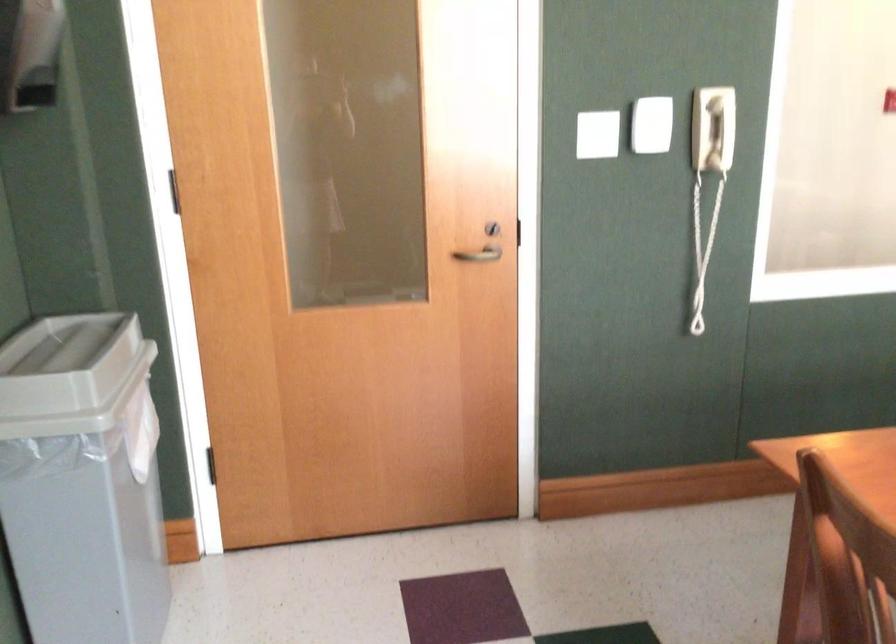
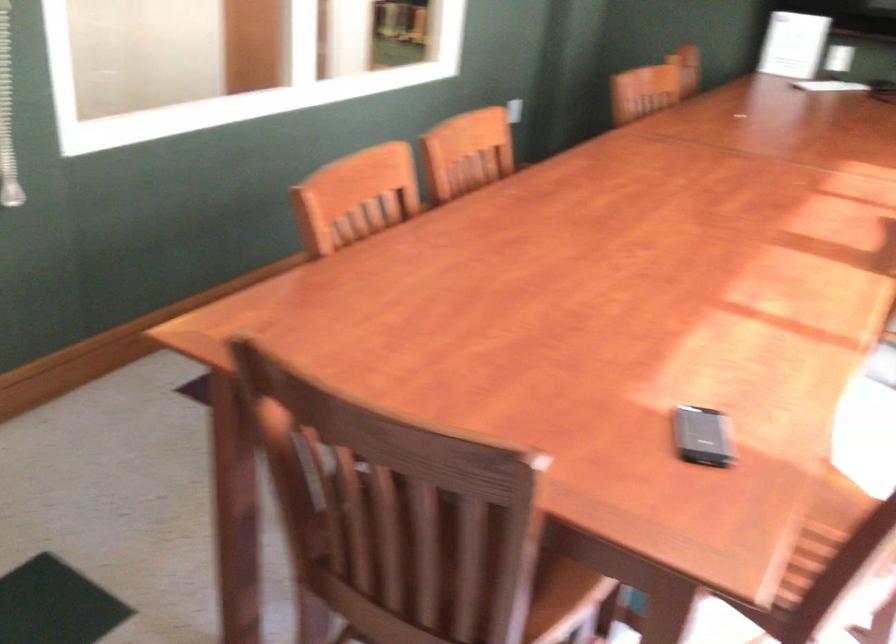
Question: The first image is from the beginning of the video and the second image is from the end. How did the camera likely rotate when shooting the video?

Choices:
 (A) Left
 (B) Right
 (C) Up
 (D) Down

Answer: (B)